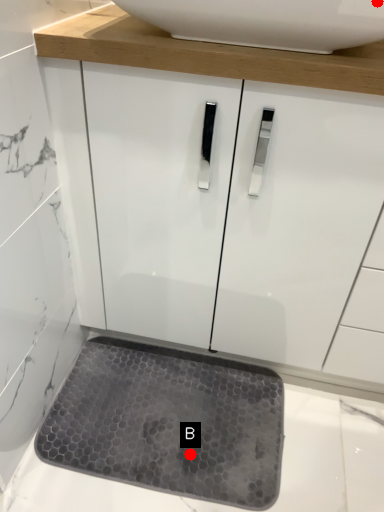
Question: Two points are circled on the image, labeled by A and B beside each circle. Which point appears farthest from the camera in this image?

Choices:
 (A) A is further
 (B) B is further

Answer: (B)